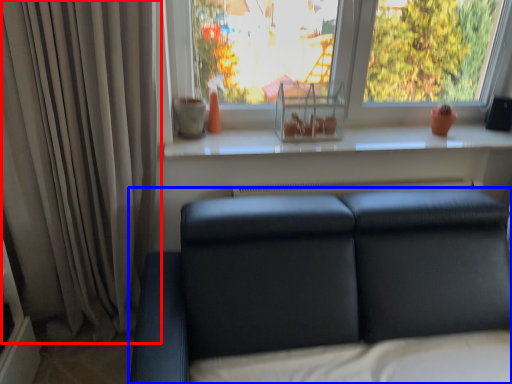
Question: Which of the following is the farthest to the observer, curtain (highlighted by a red box) or studio couch (highlighted by a blue box)?

Choices:
 (A) curtain
 (B) studio couch

Answer: (A)